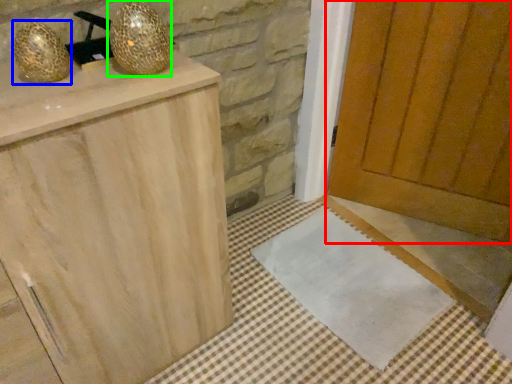
Question: Which object is positioned farthest from door (highlighted by a red box)? Select from disco ball (highlighted by a blue box) and disco ball (highlighted by a green box).

Choices:
 (A) disco ball
 (B) disco ball

Answer: (A)